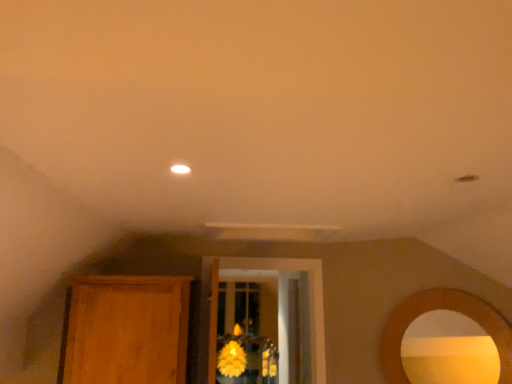
Question: In the image, is wooden armoire at left positioned in front of or behind matte gold mirror at right?

Choices:
 (A) behind
 (B) front

Answer: (A)

Question: From a real-world perspective, relative to matte gold mirror at right, is wooden armoire at left vertically above or below?

Choices:
 (A) above
 (B) below

Answer: (A)

Question: Estimate the real-world distances between objects in this image. Which object is closer to the matte gold mirror at right?

Choices:
 (A) wooden armoire at left
 (B) yellow matte flower at center

Answer: (A)

Question: Considering the real-world distances, which object is closest to the matte gold mirror at right?

Choices:
 (A) yellow matte flower at center
 (B) wooden armoire at left

Answer: (B)